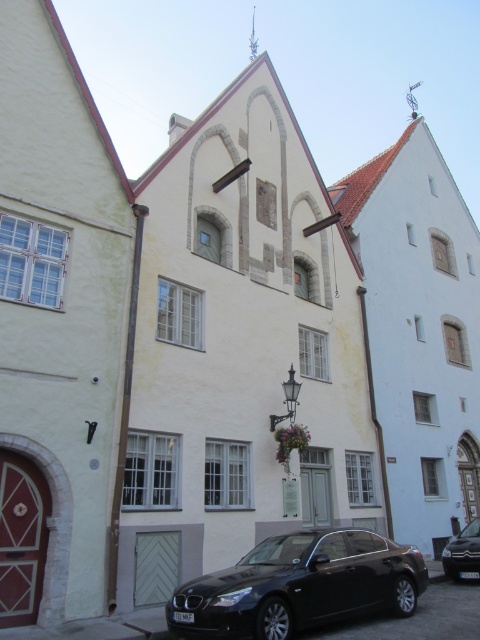
Who is positioned more to the left, light blue stone church at center or black glossy car at lower center?

light blue stone church at center

Can you confirm if light blue stone church at center is thinner than black glossy car at lower center?

In fact, light blue stone church at center might be wider than black glossy car at lower center.

Does point (343, 225) come closer to viewer compared to point (479, 563)?

No, it is behind (479, 563).

Locate an element on the screen. light blue stone church at center is located at coordinates (419, 332).

Does point (400, 456) lie behind point (380, 541)?

Yes, it is.

Which is in front, point (465, 244) or point (268, 634)?

Point (268, 634)

Find the location of a particular element. Image resolution: width=480 pixels, height=640 pixels. light blue stone church at center is located at coordinates (419, 332).

This screenshot has height=640, width=480. Find the location of `light blue stone church at center`. light blue stone church at center is located at coordinates (419, 332).

Between black metallic car at lower center and black glossy car at lower center, which one has more height?

Standing taller between the two is black glossy car at lower center.

Identify the location of black metallic car at lower center. (299, 586).

Locate an element on the screen. The image size is (480, 640). black metallic car at lower center is located at coordinates (299, 586).

At what (x,y) coordinates should I click in order to perform the action: click on black metallic car at lower center. Please return your answer as a coordinate pair (x, y). Looking at the image, I should click on (299, 586).